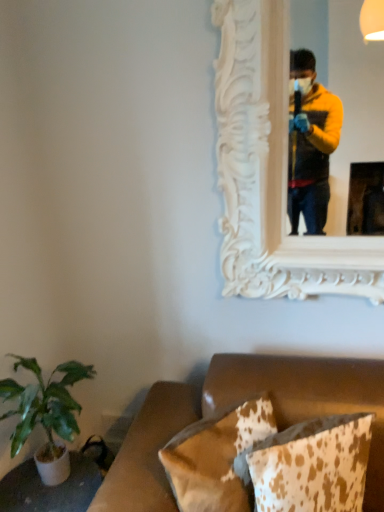
Question: Does brown cowhide pillow at lower center, which ranks as the 1th pillow in left-to-right order, appear on the right side of cowhide pillow at lower right, the first pillow when ordered from right to left?

Choices:
 (A) no
 (B) yes

Answer: (A)

Question: Is brown cowhide pillow at lower center, which ranks as the 1th pillow in left-to-right order, placed right next to cowhide pillow at lower right, the first pillow when ordered from right to left?

Choices:
 (A) yes
 (B) no

Answer: (B)

Question: Considering the relative positions of brown cowhide pillow at lower center, which appears as the 2th pillow when viewed from the right, and cowhide pillow at lower right, the first pillow when ordered from right to left, in the image provided, is brown cowhide pillow at lower center, which appears as the 2th pillow when viewed from the right, behind cowhide pillow at lower right, the first pillow when ordered from right to left,?

Choices:
 (A) yes
 (B) no

Answer: (A)

Question: Considering the relative sizes of brown cowhide pillow at lower center, which appears as the 2th pillow when viewed from the right, and cowhide pillow at lower right, the first pillow when ordered from right to left, in the image provided, is brown cowhide pillow at lower center, which appears as the 2th pillow when viewed from the right, shorter than cowhide pillow at lower right, the first pillow when ordered from right to left,?

Choices:
 (A) no
 (B) yes

Answer: (B)

Question: From the image's perspective, is brown cowhide pillow at lower center, which appears as the 2th pillow when viewed from the right, below cowhide pillow at lower right, which ranks as the second pillow in left-to-right order?

Choices:
 (A) yes
 (B) no

Answer: (A)

Question: Considering the positions of white carved wood mirror at upper center and cowhide pillow at lower right, which ranks as the second pillow in left-to-right order, in the image, is white carved wood mirror at upper center taller or shorter than cowhide pillow at lower right, which ranks as the second pillow in left-to-right order,?

Choices:
 (A) short
 (B) tall

Answer: (B)

Question: Visually, is white carved wood mirror at upper center positioned to the left or to the right of cowhide pillow at lower right, the first pillow when ordered from right to left?

Choices:
 (A) left
 (B) right

Answer: (B)

Question: From the image's perspective, is white carved wood mirror at upper center positioned above or below cowhide pillow at lower right, which ranks as the second pillow in left-to-right order?

Choices:
 (A) below
 (B) above

Answer: (B)

Question: Is point [223, 0] closer or farther from the camera than point [271, 504]?

Choices:
 (A) farther
 (B) closer

Answer: (A)

Question: Do you think cowhide pillow at lower right, the first pillow when ordered from right to left, is within brown cowhide pillow at lower center, which ranks as the 1th pillow in left-to-right order, or outside of it?

Choices:
 (A) inside
 (B) outside

Answer: (B)

Question: Considering the positions of point (324, 451) and point (218, 462), is point (324, 451) closer or farther from the camera than point (218, 462)?

Choices:
 (A) farther
 (B) closer

Answer: (B)

Question: From a real-world perspective, is cowhide pillow at lower right, the first pillow when ordered from right to left, physically located above or below brown cowhide pillow at lower center, which appears as the 2th pillow when viewed from the right?

Choices:
 (A) above
 (B) below

Answer: (A)

Question: From the image's perspective, relative to brown cowhide pillow at lower center, which appears as the 2th pillow when viewed from the right, is cowhide pillow at lower right, the first pillow when ordered from right to left, above or below?

Choices:
 (A) above
 (B) below

Answer: (A)

Question: Considering the positions of white carved wood mirror at upper center and green leafy plant at lower left in the image, is white carved wood mirror at upper center wider or thinner than green leafy plant at lower left?

Choices:
 (A) wide
 (B) thin

Answer: (B)

Question: Would you say white carved wood mirror at upper center is inside or outside green leafy plant at lower left?

Choices:
 (A) inside
 (B) outside

Answer: (B)